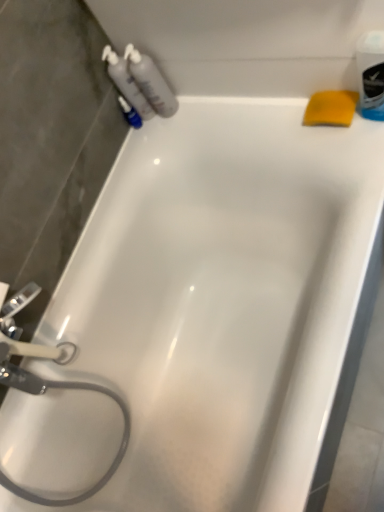
In order to click on free space between translucent plastic bottles at upper left, which is the 2th cleaning product in right-to-left order, and yellow sponge at upper right in this screenshot , I will do `click(241, 112)`.